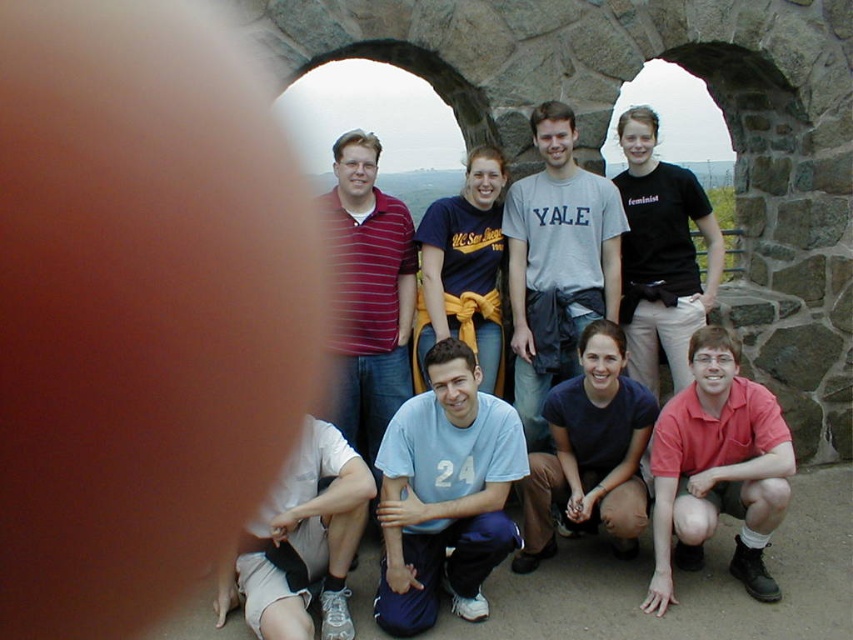
You are a photographer trying to identify the position of two people in the group photo. The red cotton shirt at lower right and the striped cotton shirt at center are both visible. Which of these two shirts is positioned lower in the image?

The red cotton shirt at lower right is positioned lower in the image than the striped cotton shirt at center.